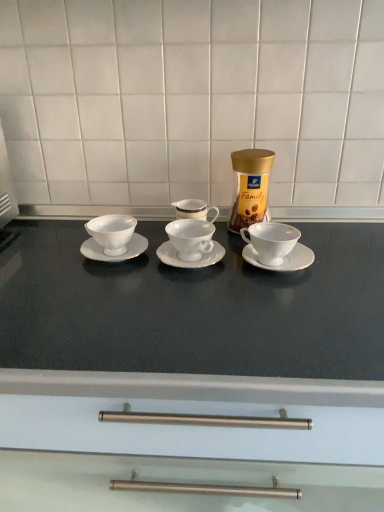
This screenshot has height=512, width=384. Identify the location of blank area to the left of white ceramic saucer at right, marked as the 3th saucer in a left-to-right arrangement. (196, 272).